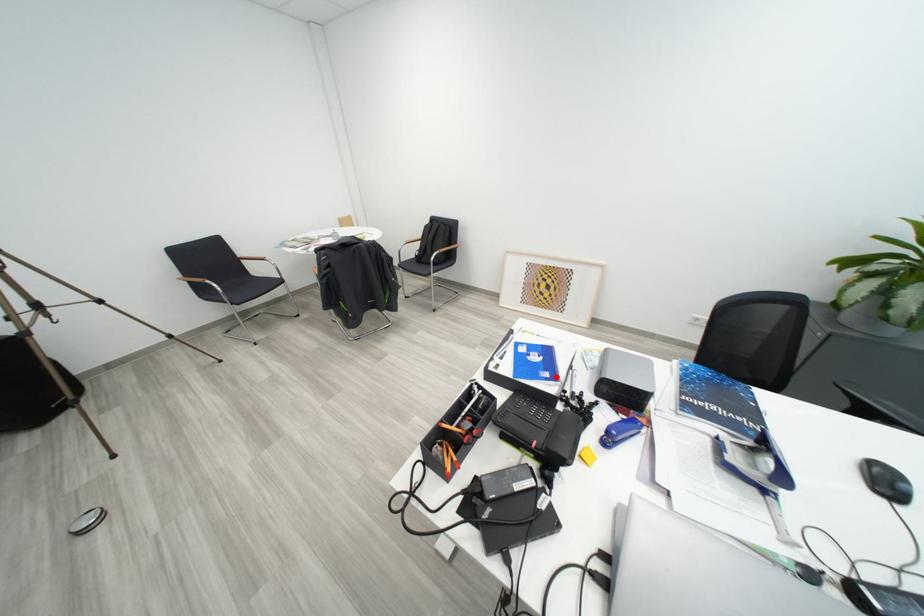
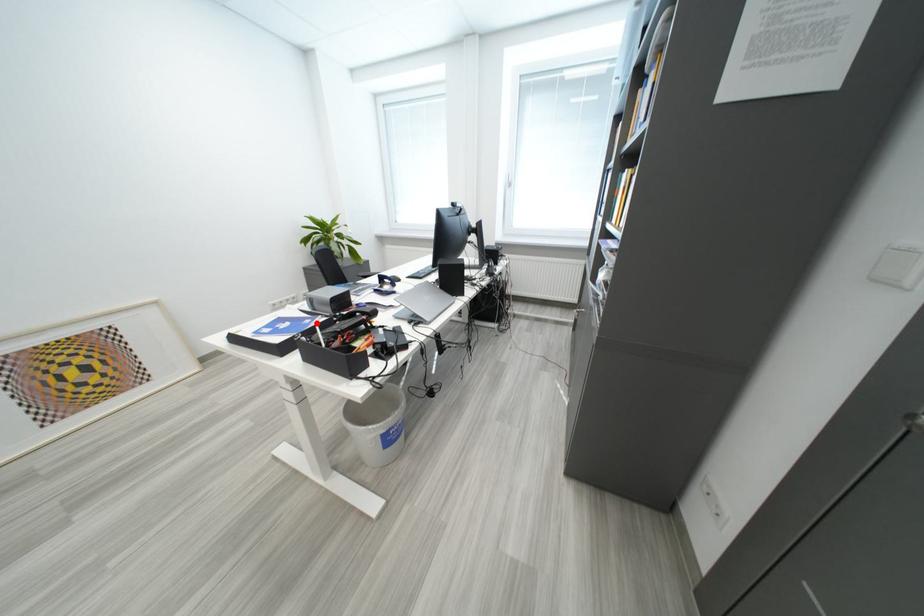
I am providing you with two images of the same scene from different viewpoints. A red point is marked on the first image and another point is marked on the second image. Does the point marked in image1 correspond to the same location as the one in image2?

Yes